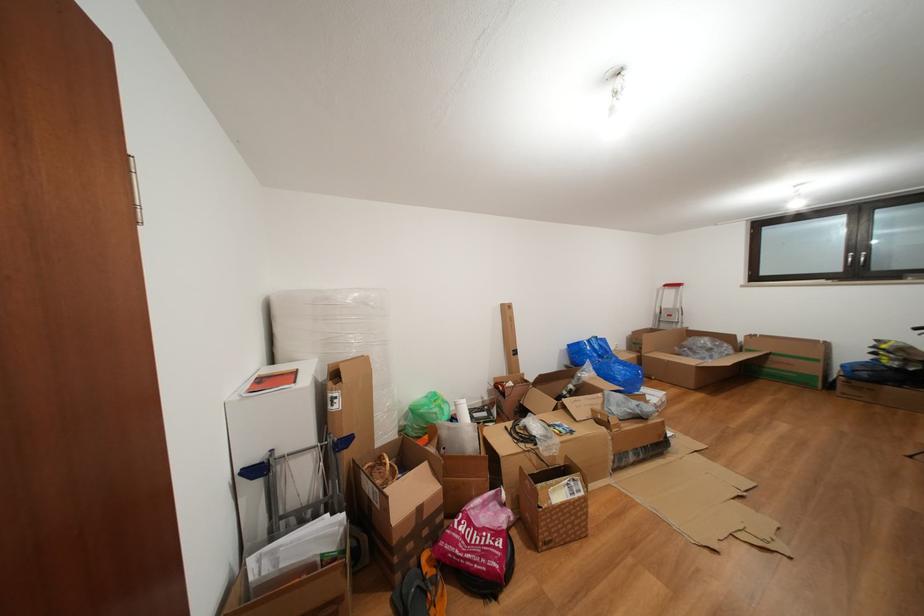
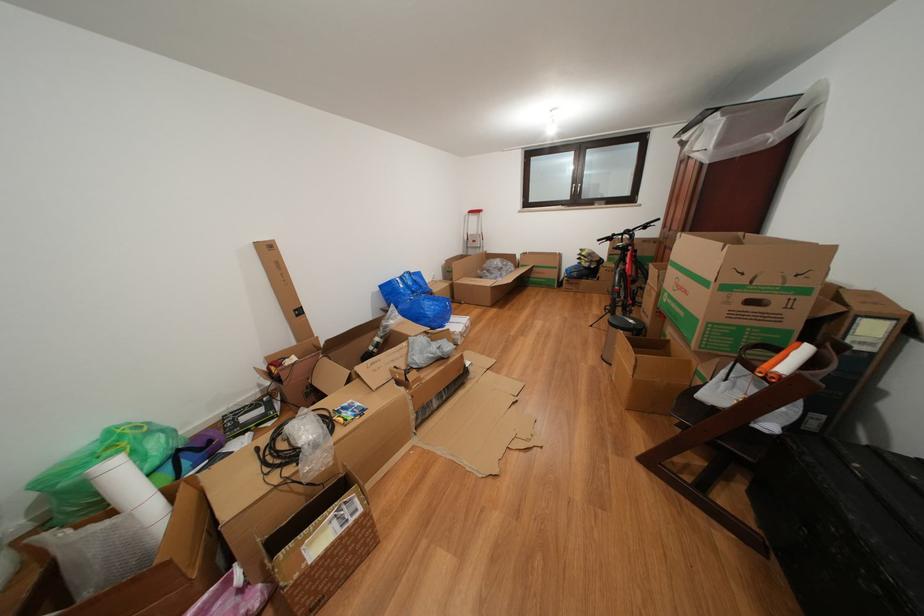
Where in the second image is the point corresponding to point (846, 275) from the first image?

(576, 203)